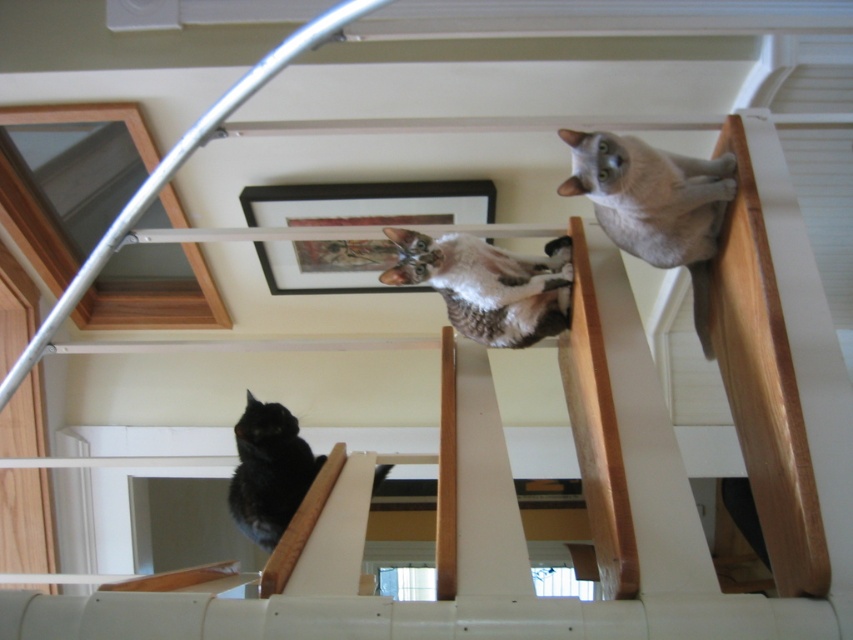
Can you confirm if silvery gray fur at upper right is positioned to the right of black fur cat at lower left?

Indeed, silvery gray fur at upper right is positioned on the right side of black fur cat at lower left.

Is point (705, 240) closer to viewer compared to point (271, 525)?

Yes, it is in front of point (271, 525).

What do you see at coordinates (650, 196) in the screenshot?
I see `silvery gray fur at upper right` at bounding box center [650, 196].

At what (x,y) coordinates should I click in order to perform the action: click on silvery gray fur at upper right. Please return your answer as a coordinate pair (x, y). Looking at the image, I should click on (650, 196).

Who is taller, tabby fur cat at center or black fur cat at lower left?

black fur cat at lower left is taller.

Does tabby fur cat at center appear over black fur cat at lower left?

Yes, tabby fur cat at center is above black fur cat at lower left.

Is point (480, 339) more distant than point (274, 497)?

No.

Locate an element on the screen. The image size is (853, 640). tabby fur cat at center is located at coordinates (488, 284).

Who is positioned more to the right, silvery gray fur at upper right or tabby fur cat at center?

silvery gray fur at upper right is more to the right.

Is silvery gray fur at upper right thinner than tabby fur cat at center?

Indeed, silvery gray fur at upper right has a lesser width compared to tabby fur cat at center.

Between point (695, 241) and point (515, 291), which one is positioned in front?

Positioned in front is point (695, 241).

Locate an element on the screen. The image size is (853, 640). silvery gray fur at upper right is located at coordinates (650, 196).